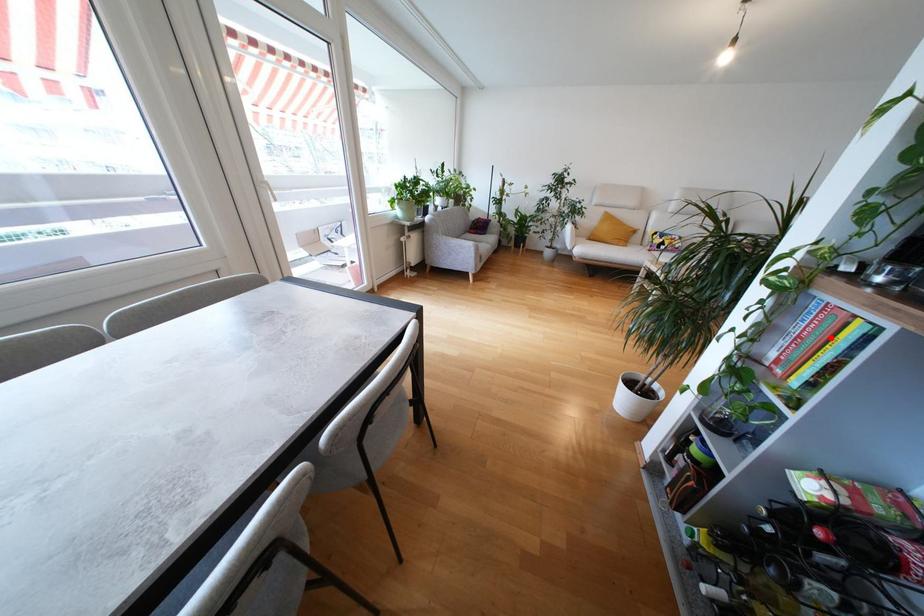
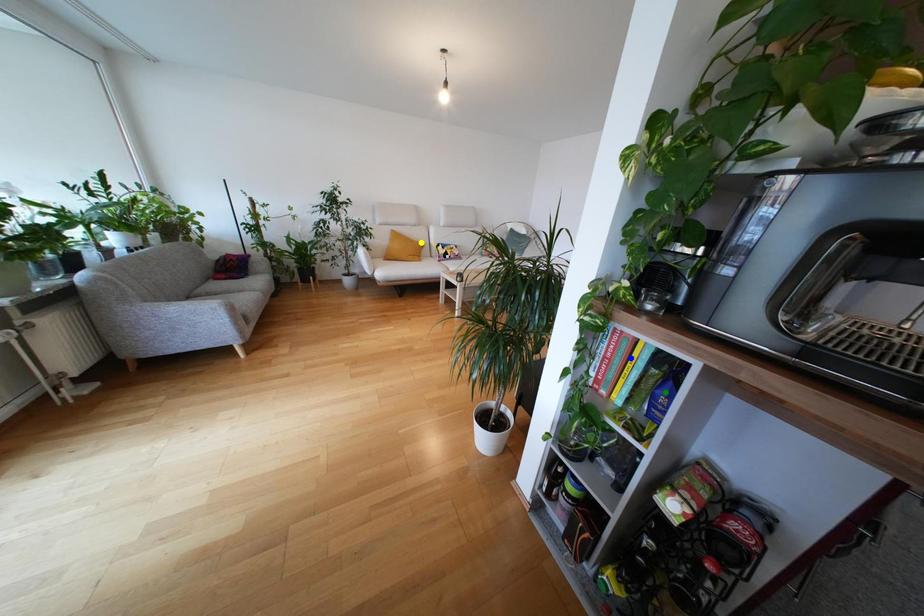
Question: I am providing you with two images of the same scene from different viewpoints. A red point is marked on the first image. You are given multiple points on the second image. In image 2, which mark is for the same physical point as the one in image 1?

Choices:
 (A) green point
 (B) blue point
 (C) yellow point

Answer: (B)